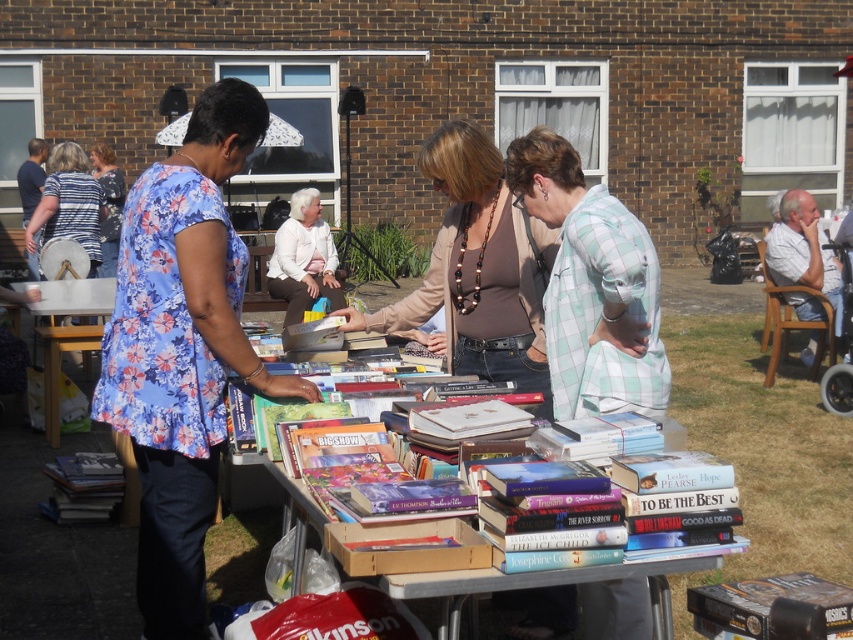
Question: Which point is farther to the camera?

Choices:
 (A) white cotton shirt at right
 (B) hardcover book at lower left

Answer: (A)

Question: Is floral fabric blouse at left to the right of striped fabric blouse at upper left from the viewer's perspective?

Choices:
 (A) yes
 (B) no

Answer: (A)

Question: Which point is farther to the camera?

Choices:
 (A) (585, 193)
 (B) (837, 320)

Answer: (B)

Question: Which point is closer to the camera?

Choices:
 (A) green plaid shirt at center
 (B) striped fabric blouse at upper left

Answer: (A)

Question: Observing the image, what is the correct spatial positioning of floral fabric blouse at left in reference to white cotton shirt at right?

Choices:
 (A) left
 (B) right

Answer: (A)

Question: Is the position of green plaid shirt at center less distant than that of white cotton shirt at right?

Choices:
 (A) no
 (B) yes

Answer: (B)